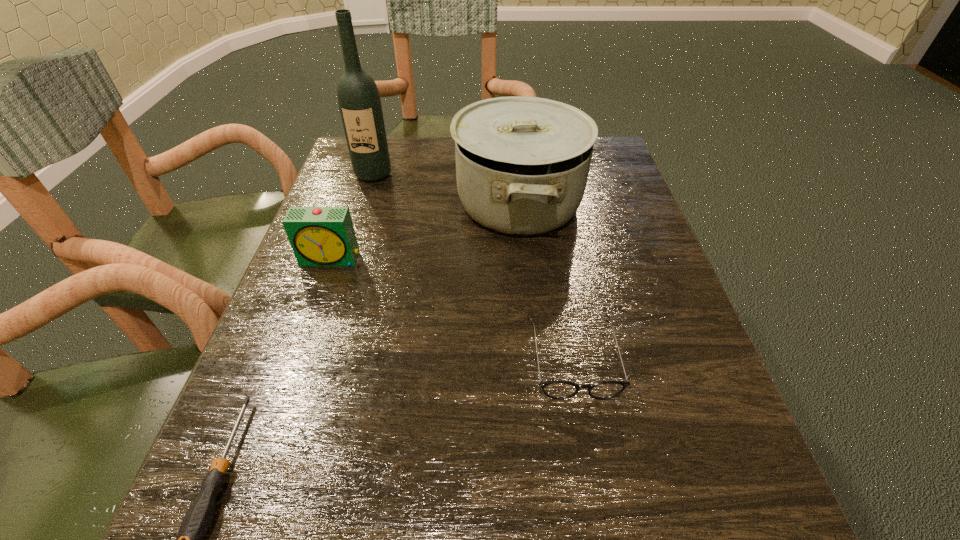
At what (x,y) coordinates should I click in order to perform the action: click on wine bottle. Please return your answer as a coordinate pair (x, y). The height and width of the screenshot is (540, 960). Looking at the image, I should click on (359, 101).

The image size is (960, 540). Identify the location of the fourth shortest object. (522, 163).

You are a GUI agent. You are given a task and a screenshot of the screen. Output one action in this format:
    pyautogui.click(x=<x>, y=<y>)
    Task: Click on the alarm clock
    
    Given the screenshot: What is the action you would take?
    pyautogui.click(x=320, y=236)

The width and height of the screenshot is (960, 540). In order to click on the fourth tallest object in this screenshot , I will do `click(559, 390)`.

The width and height of the screenshot is (960, 540). Find the location of `spectacles`. spectacles is located at coordinates (559, 390).

At what (x,y) coordinates should I click in order to perform the action: click on vacant area located 0.330m on the labeled side of the tallest object. Please return your answer as a coordinate pair (x, y). Looking at the image, I should click on (339, 285).

Identify the location of vacant space situated on the front of the fourth shortest object. (531, 329).

I want to click on free space located 0.270m on the front-facing side of the third shortest object, so click(x=283, y=394).

I want to click on blank space located through the lenses of the second shortest object, so click(602, 521).

Locate an element on the screen. wine bottle that is at the far edge is located at coordinates (359, 101).